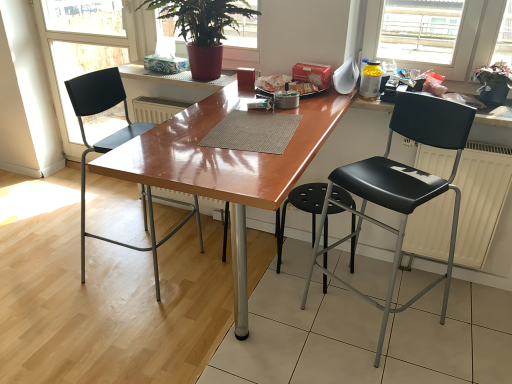
What are the coordinates of `vacant area to the left of black plastic chair at left, which is counted as the second chair, starting from the right` in the screenshot? It's located at (59, 268).